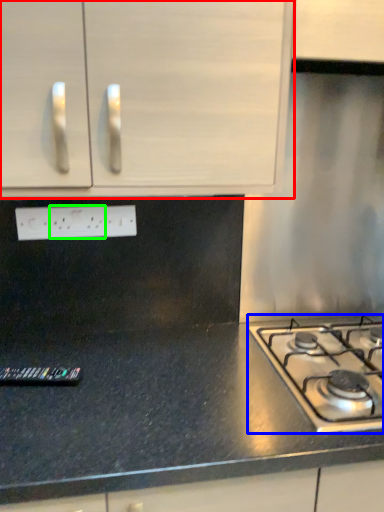
Question: Based on their relative distances, which object is nearer to cabinetry (highlighted by a red box)? Choose from gas stove (highlighted by a blue box) and electric outlet (highlighted by a green box).

Choices:
 (A) gas stove
 (B) electric outlet

Answer: (B)